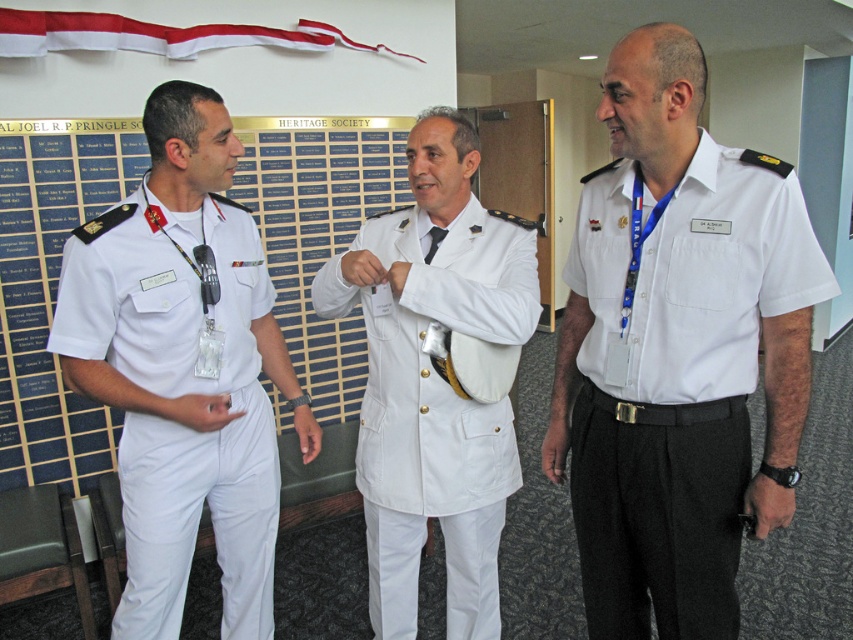
You are standing in the formal space where the three individuals are conversing. There are two points marked in the image. If you were to walk from point [241,384] to point [33,24], would you be moving towards the plaque or away from it?

Since point [241,384] is in front of point [33,24], moving from the former to the latter would mean moving away from the plaque.

You are a photographer positioned in front of the plaque. You want to take a photo of the white matte uniform at left and the white fabric ribbon at upper center. Which object should you focus on first to ensure both are in sharp focus?

The white matte uniform at left is closer to the viewer than the white fabric ribbon at upper center. To ensure both are in sharp focus, you should focus on the white matte uniform at left first, as it is the closer object.

From the picture: You are a photographer trying to capture a clear photo of both the white cotton shirt at center and the white fabric ribbon at upper center. Which object should you focus on first to ensure it appears sharp in the photo?

The white cotton shirt at center should be focused on first because it is much taller than the white fabric ribbon at upper center, making it more prominent in the frame.